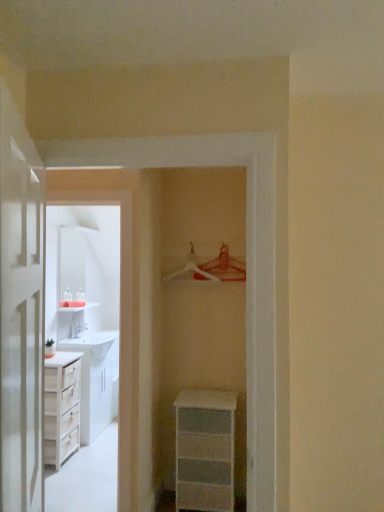
Question: Looking at their shapes, would you say metallic silver hanger at upper center, the second hanger from the left, is wider or thinner than white wood cabinet at left?

Choices:
 (A) thin
 (B) wide

Answer: (A)

Question: Choose the correct answer: Is metallic silver hanger at upper center, the 1th hanger positioned from the right, inside white wood cabinet at left or outside it?

Choices:
 (A) outside
 (B) inside

Answer: (A)

Question: Based on their relative distances, which object is farther from the white wood cabinet at left?

Choices:
 (A) metallic silver hanger at upper center, the 1th hanger positioned from the right
 (B) white glossy door at left
 (C) white plastic chest of drawers at lower center
 (D) white plastic hanger at center, acting as the 1th hanger starting from the left

Answer: (B)

Question: Estimate the real-world distances between objects in this image. Which object is closer to the metallic silver hanger at upper center, the 1th hanger positioned from the right?

Choices:
 (A) white plastic chest of drawers at lower center
 (B) white glossy door at left
 (C) white wood cabinet at left
 (D) white plastic hanger at center, arranged as the second hanger when viewed from the right

Answer: (D)